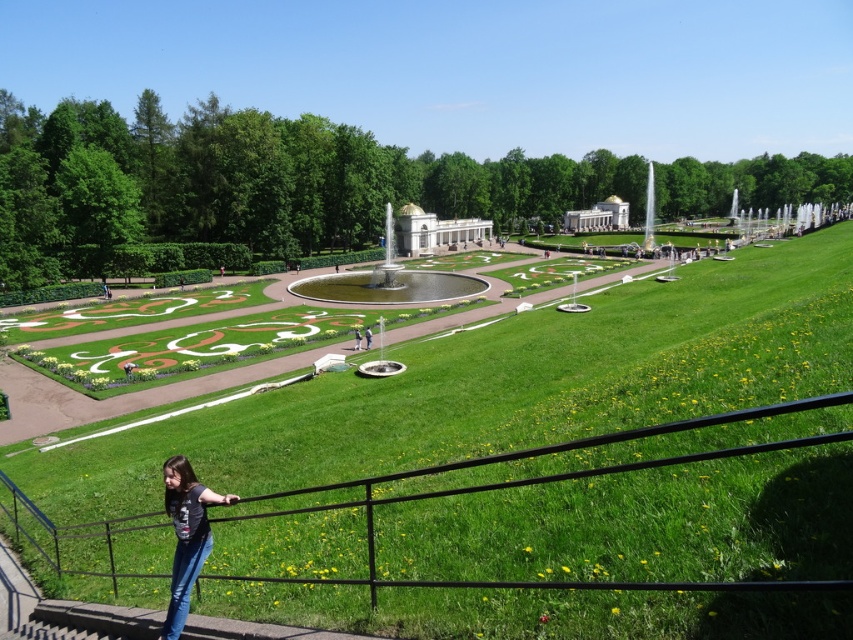
Between green grass at center and white marble palace at center, which one has less height?

With less height is green grass at center.

Can you confirm if green grass at center is wider than white marble palace at center?

Indeed, green grass at center has a greater width compared to white marble palace at center.

Find the location of `green grass at center`. green grass at center is located at coordinates (502, 387).

Who is higher up, gold metallic fountain at center or denim jeans at lower left?

gold metallic fountain at center is above.

This screenshot has width=853, height=640. I want to click on gold metallic fountain at center, so click(402, 266).

Which is in front, point (433, 300) or point (184, 611)?

Point (184, 611)

Locate an element on the screen. This screenshot has width=853, height=640. gold metallic fountain at center is located at coordinates (402, 266).

Can you confirm if green grass at center is positioned to the right of gold dome building at center?

Correct, you'll find green grass at center to the right of gold dome building at center.

Does point (383, 522) come behind point (426, 241)?

No, (383, 522) is in front of (426, 241).

Identify the location of green grass at center. The width and height of the screenshot is (853, 640). (502, 387).